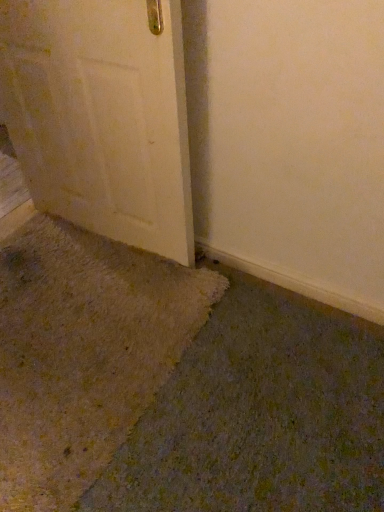
Describe the element at coordinates (102, 116) in the screenshot. I see `white matte door at left` at that location.

This screenshot has height=512, width=384. I want to click on white matte door at left, so [x=102, y=116].

Where is `white matte door at left`? white matte door at left is located at coordinates (102, 116).